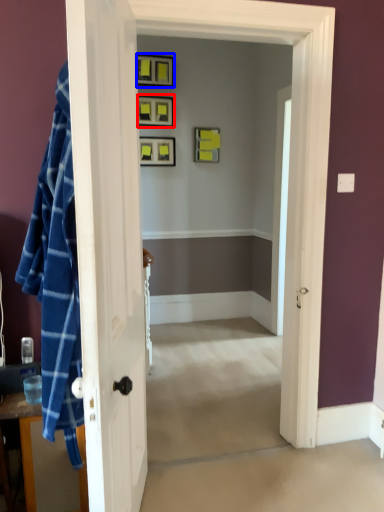
Question: Among these objects, which one is nearest to the camera, picture frame (highlighted by a red box) or picture frame (highlighted by a blue box)?

Choices:
 (A) picture frame
 (B) picture frame

Answer: (B)